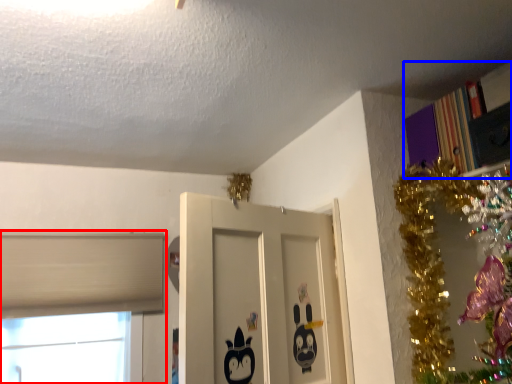
Question: Which of the following is the closest to the observer, window (highlighted by a red box) or bookcase (highlighted by a blue box)?

Choices:
 (A) window
 (B) bookcase

Answer: (B)